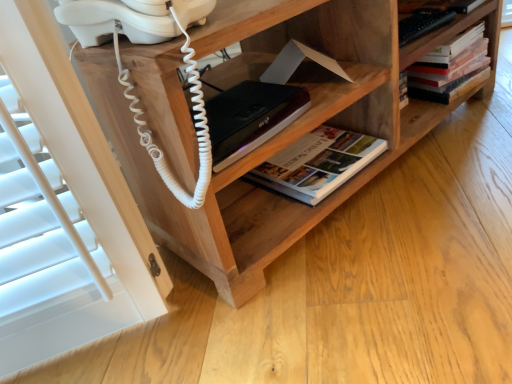
Question: From the image's perspective, is wooden shelf at center below hardcover book at center, the first book in the bottom-to-top sequence?

Choices:
 (A) yes
 (B) no

Answer: (B)

Question: Can you confirm if wooden shelf at center is taller than hardcover book at center, the first book in the bottom-to-top sequence?

Choices:
 (A) yes
 (B) no

Answer: (A)

Question: Can we say wooden shelf at center lies outside hardcover book at center, the first book in the bottom-to-top sequence?

Choices:
 (A) no
 (B) yes

Answer: (B)

Question: Is wooden shelf at center thinner than hardcover book at center, the first book positioned from the left?

Choices:
 (A) yes
 (B) no

Answer: (B)

Question: Does wooden shelf at center have a larger size compared to hardcover book at center, acting as the 2th book starting from the right?

Choices:
 (A) no
 (B) yes

Answer: (B)

Question: Is hardcover book at upper right, the 2th book in the left-to-right sequence, inside or outside of wooden shelf at center?

Choices:
 (A) outside
 (B) inside

Answer: (B)

Question: From a real-world perspective, is hardcover book at upper right, the first book from the right, positioned above or below wooden shelf at center?

Choices:
 (A) above
 (B) below

Answer: (B)

Question: Considering the positions of point (420, 96) and point (328, 86), is point (420, 96) closer or farther from the camera than point (328, 86)?

Choices:
 (A) closer
 (B) farther

Answer: (B)

Question: From their relative heights in the image, would you say hardcover book at upper right, the first book from the right, is taller or shorter than wooden shelf at center?

Choices:
 (A) tall
 (B) short

Answer: (B)

Question: From the image's perspective, is hardcover book at center, the first book in the bottom-to-top sequence, above or below black matte book at center?

Choices:
 (A) above
 (B) below

Answer: (B)

Question: Does point (328, 162) appear closer or farther from the camera than point (215, 150)?

Choices:
 (A) farther
 (B) closer

Answer: (A)

Question: Visually, is hardcover book at center, the 2th book when ordered from top to bottom, positioned to the left or to the right of black matte book at center?

Choices:
 (A) right
 (B) left

Answer: (A)

Question: Is hardcover book at center, acting as the 2th book starting from the right, bigger or smaller than black matte book at center?

Choices:
 (A) small
 (B) big

Answer: (B)

Question: From the image's perspective, relative to hardcover book at upper right, the first book from the right, is wooden shelf at center above or below?

Choices:
 (A) above
 (B) below

Answer: (B)

Question: In terms of size, does wooden shelf at center appear bigger or smaller than hardcover book at upper right, the 2th book in the left-to-right sequence?

Choices:
 (A) small
 (B) big

Answer: (B)